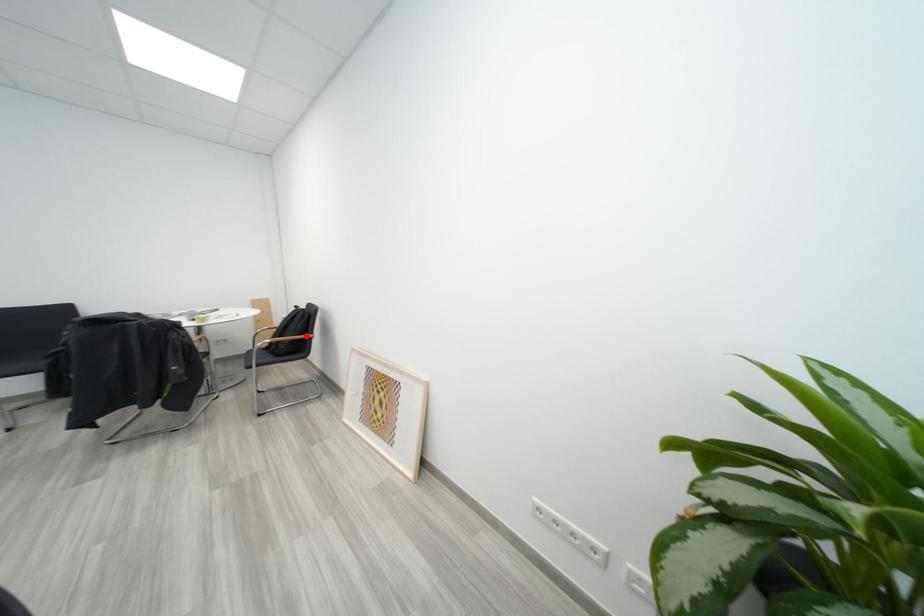
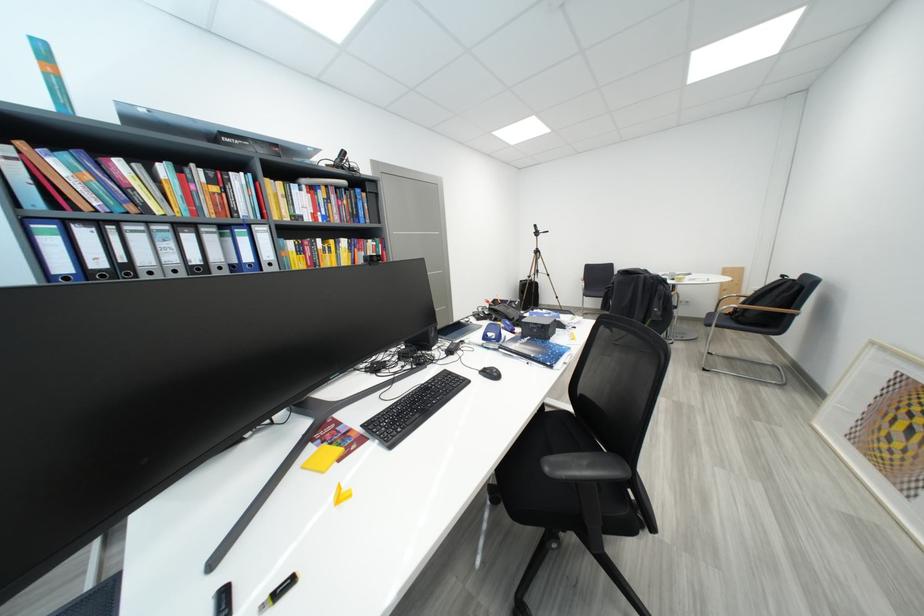
Question: I am providing you with two images of the same scene from different viewpoints. A red point is marked on the first image. At the location where the point appears in image 1, is it still visible in image 2?

Choices:
 (A) Yes
 (B) No

Answer: (A)